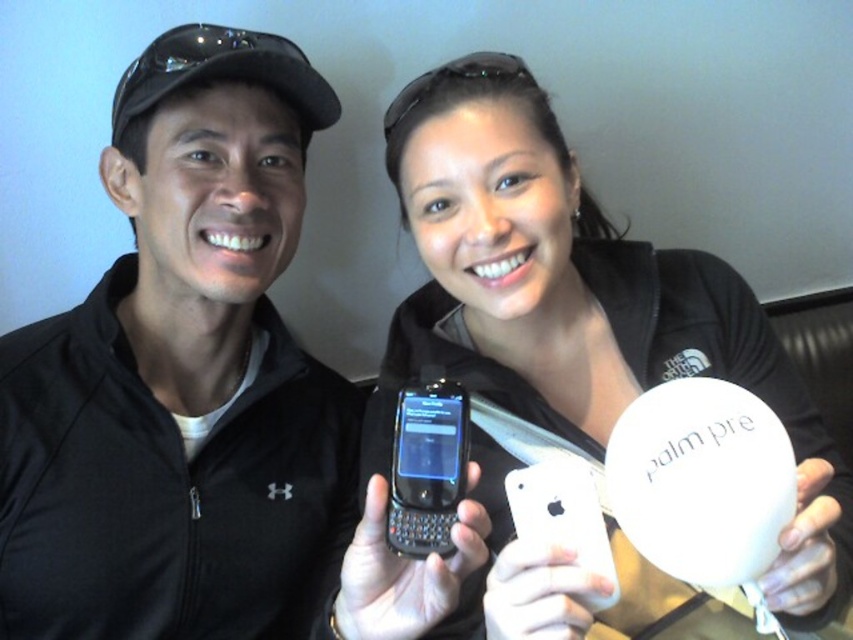
Question: Is the position of black matte phone at center more distant than that of white matte palm pre case at center?

Choices:
 (A) yes
 (B) no

Answer: (B)

Question: Is white matte palm pre case at center thinner than black plastic smartphone at center?

Choices:
 (A) no
 (B) yes

Answer: (A)

Question: Which of the following is the farthest from the observer?

Choices:
 (A) black matte phone at center
 (B) white matte palm pre case at center

Answer: (B)

Question: Which point is farther to the camera?

Choices:
 (A) (506, 305)
 (B) (163, 70)
 (C) (410, 456)

Answer: (B)

Question: Is white matte palm pre case at center to the right of black plastic smartphone at center from the viewer's perspective?

Choices:
 (A) no
 (B) yes

Answer: (B)

Question: Which object is closer to the camera taking this photo?

Choices:
 (A) black plastic smartphone at center
 (B) black matte phone at center

Answer: (B)